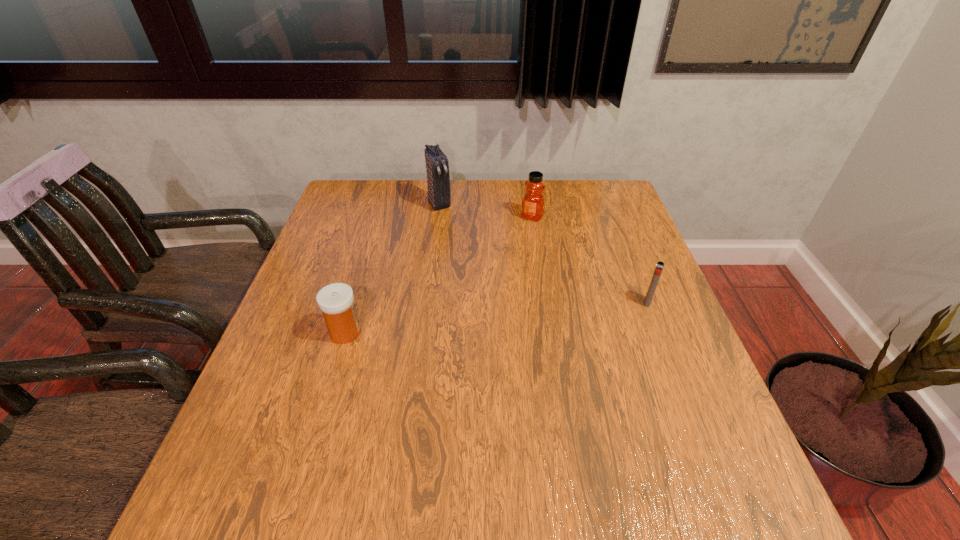
Locate an element on the screen. the nearest object is located at coordinates (336, 300).

Image resolution: width=960 pixels, height=540 pixels. In order to click on the leftmost object in this screenshot , I will do `click(336, 300)`.

I want to click on igniter, so click(659, 267).

You are a GUI agent. You are given a task and a screenshot of the screen. Output one action in this format:
    pyautogui.click(x=<x>, y=<y>)
    Task: Click on the rightmost object
    The width and height of the screenshot is (960, 540).
    Given the screenshot: What is the action you would take?
    pyautogui.click(x=659, y=267)

The width and height of the screenshot is (960, 540). What are the coordinates of `clutch bag` in the screenshot? It's located at (438, 179).

Image resolution: width=960 pixels, height=540 pixels. What are the coordinates of `the tallest object` in the screenshot? It's located at (438, 179).

The width and height of the screenshot is (960, 540). I want to click on honey, so click(x=533, y=201).

Locate an element on the screen. This screenshot has height=540, width=960. the second tallest object is located at coordinates (533, 201).

The width and height of the screenshot is (960, 540). I want to click on free space located 0.070m on the front of the leftmost object, so click(x=334, y=372).

The width and height of the screenshot is (960, 540). Find the location of `free region located on the front of the rightmost object`. free region located on the front of the rightmost object is located at coordinates (675, 373).